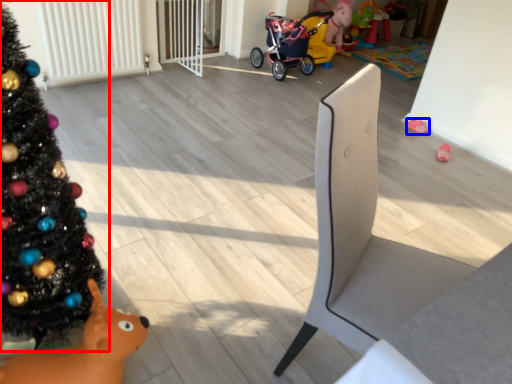
Question: Which of the following is the farthest to the observer, christmas tree (highlighted by a red box) or toy (highlighted by a blue box)?

Choices:
 (A) christmas tree
 (B) toy

Answer: (B)